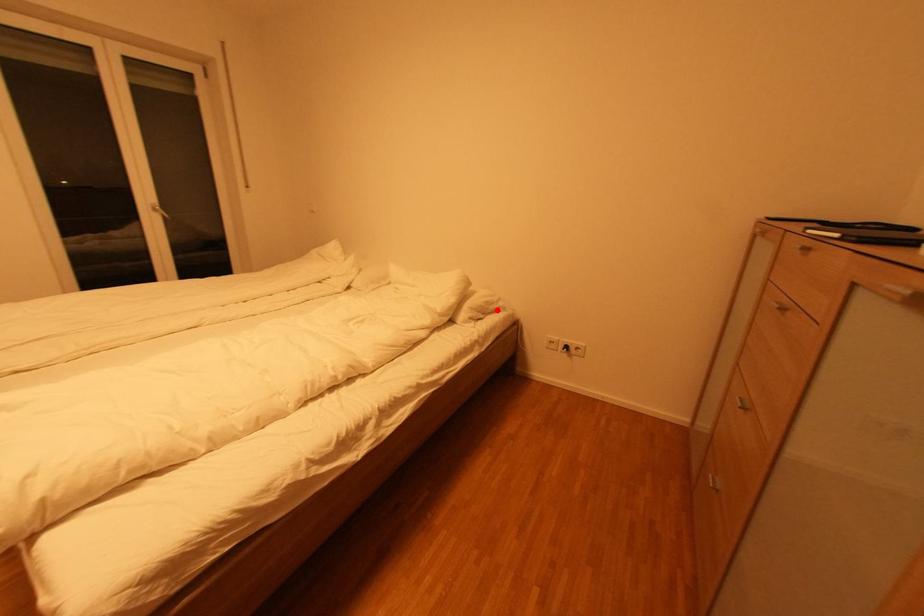
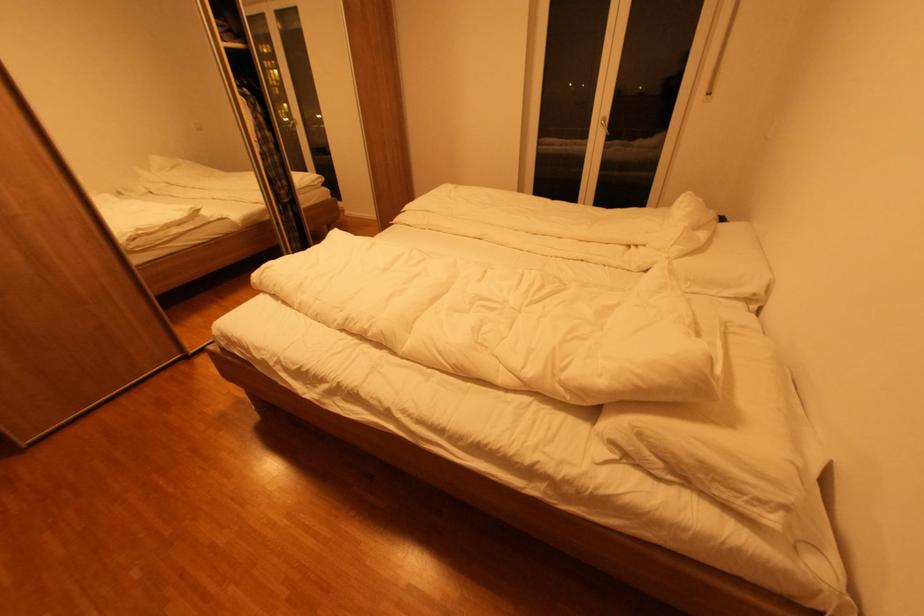
Find the pixel in the second image that matches the highlighted location in the first image.

(723, 495)